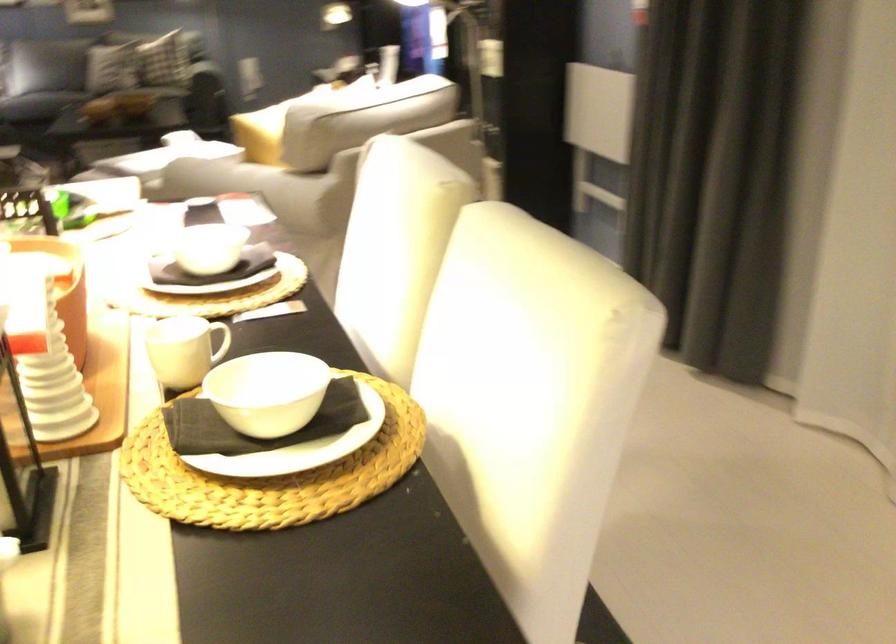
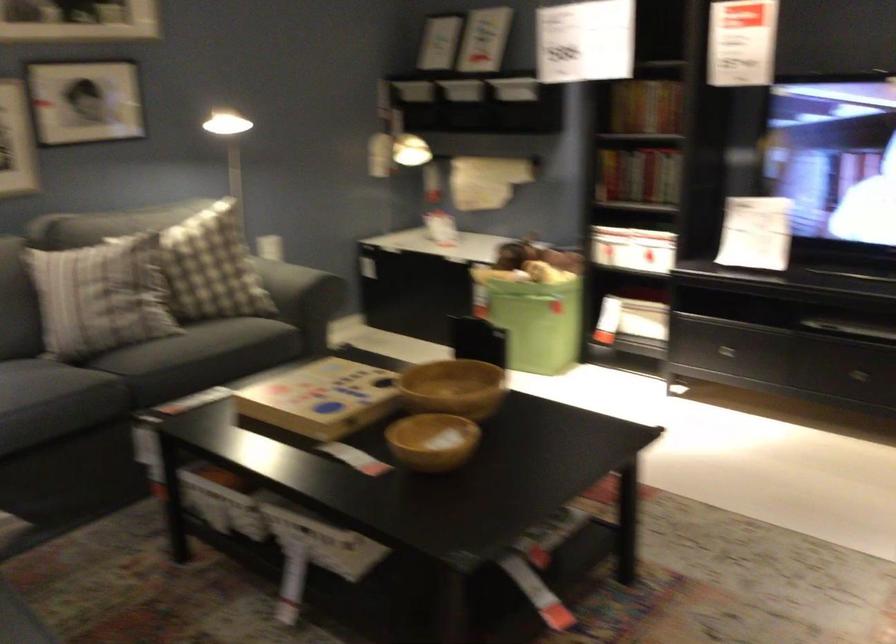
Find the pixel in the second image that matches [104,104] in the first image.

(433, 440)